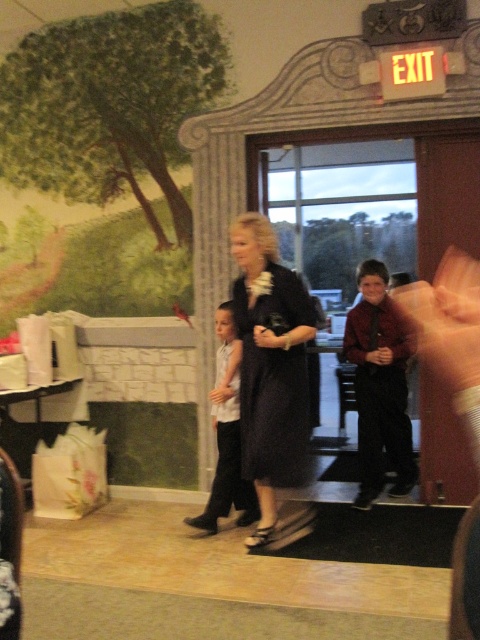
You are a photographer standing at the camera position. You want to take a photo of the dark blue dress at center. Is the distance between you and the dress sufficient to capture a clear, full body shot without needing to zoom in excessively?

The dark blue dress at center and the camera are 3.03 meters apart from each other. At this distance, a photographer can comfortably capture a clear full body shot without excessive zooming, as 3 meters is a typical comfortable range for such photography.

You are standing in the banquet hall and want to take a photo of both the woman holding the bouquet of white flowers and the child next to her. To ensure both are in focus, you need to know which of the two points, point (391, 368) or point (220, 426), is closer to the camera. Which point is closer?

Point (220, 426) is closer to the camera than point (391, 368).